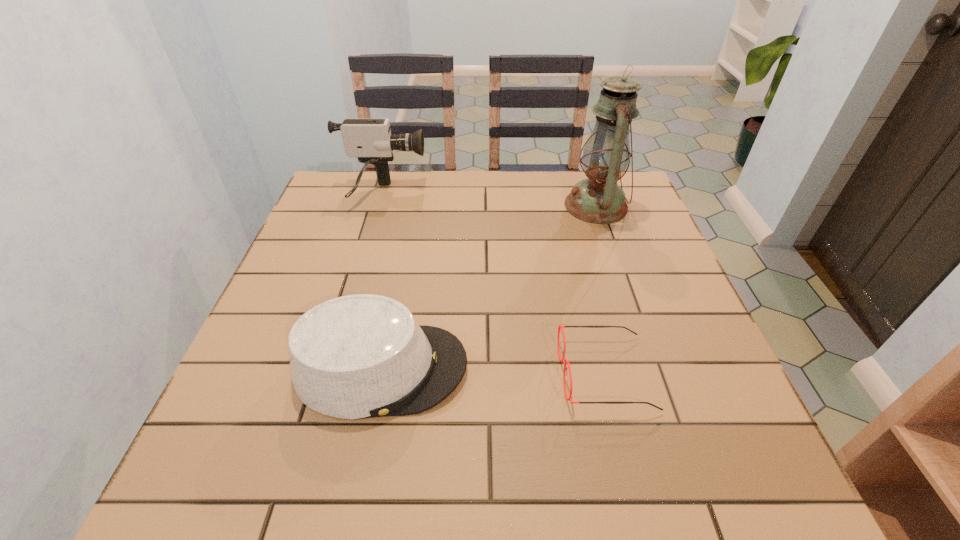
The image size is (960, 540). What are the coordinates of `the tallest object` in the screenshot? It's located at (598, 199).

The height and width of the screenshot is (540, 960). I want to click on camcorder, so click(x=370, y=140).

The height and width of the screenshot is (540, 960). Find the location of `the third tallest object`. the third tallest object is located at coordinates (359, 356).

Locate an element on the screen. spectacles is located at coordinates (562, 360).

Identify the location of vacant space located on the left of the tallest object. This screenshot has width=960, height=540. (467, 206).

Locate an element on the screen. The height and width of the screenshot is (540, 960). vacant space located on the recording direction of the camcorder is located at coordinates (523, 194).

Locate an element on the screen. vacant space located 0.160m on the front-facing side of the third tallest object is located at coordinates (550, 368).

You are a GUI agent. You are given a task and a screenshot of the screen. Output one action in this format:
    pyautogui.click(x=<x>, y=<y>)
    Task: Click on the free region located 0.140m on the front-facing side of the spectacles
    This screenshot has height=540, width=960.
    Given the screenshot: What is the action you would take?
    pos(488,373)

The width and height of the screenshot is (960, 540). Find the location of `free space located on the front-facing side of the spectacles`. free space located on the front-facing side of the spectacles is located at coordinates (356, 373).

Image resolution: width=960 pixels, height=540 pixels. Find the location of `vacant position located 0.230m on the front-facing side of the spectacles`. vacant position located 0.230m on the front-facing side of the spectacles is located at coordinates (441, 373).